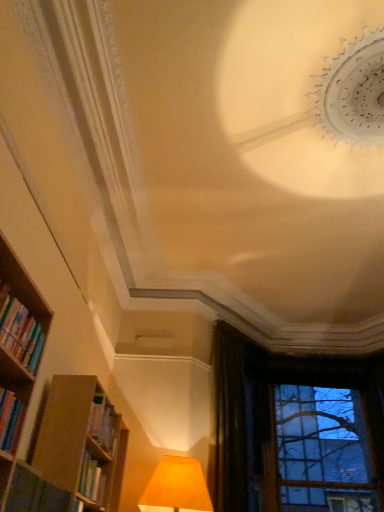
Question: From a real-world perspective, does hardcover books at left, the first book from the top, stand above dark velvet curtain at upper right?

Choices:
 (A) yes
 (B) no

Answer: (B)

Question: Does hardcover books at left, the second book ordered from the bottom, appear on the left side of dark velvet curtain at upper right?

Choices:
 (A) no
 (B) yes

Answer: (B)

Question: Is dark velvet curtain at upper right completely or partially inside hardcover books at left, the first book from the top?

Choices:
 (A) no
 (B) yes

Answer: (A)

Question: Can you confirm if hardcover books at left, the first book from the top, is bigger than dark velvet curtain at upper right?

Choices:
 (A) yes
 (B) no

Answer: (B)

Question: Is hardcover books at left, the second book ordered from the bottom, touching dark velvet curtain at upper right?

Choices:
 (A) no
 (B) yes

Answer: (A)

Question: Are hardcover books at left, the second book ordered from the bottom, and dark velvet curtain at upper right located far from each other?

Choices:
 (A) no
 (B) yes

Answer: (B)

Question: Considering the relative sizes of dark velvet curtain at upper right and transparent glass window at lower right in the image provided, is dark velvet curtain at upper right thinner than transparent glass window at lower right?

Choices:
 (A) no
 (B) yes

Answer: (B)

Question: Considering the relative sizes of dark velvet curtain at upper right and transparent glass window at lower right in the image provided, is dark velvet curtain at upper right wider than transparent glass window at lower right?

Choices:
 (A) no
 (B) yes

Answer: (A)

Question: Can you confirm if dark velvet curtain at upper right is taller than transparent glass window at lower right?

Choices:
 (A) no
 (B) yes

Answer: (B)

Question: Can you confirm if dark velvet curtain at upper right is bigger than transparent glass window at lower right?

Choices:
 (A) yes
 (B) no

Answer: (B)

Question: Is there a large distance between dark velvet curtain at upper right and transparent glass window at lower right?

Choices:
 (A) no
 (B) yes

Answer: (B)

Question: From a real-world perspective, is dark velvet curtain at upper right below transparent glass window at lower right?

Choices:
 (A) no
 (B) yes

Answer: (B)

Question: Would you say transparent glass window at lower right contains hardcover book at lower left, the second book when ordered from top to bottom?

Choices:
 (A) yes
 (B) no

Answer: (B)